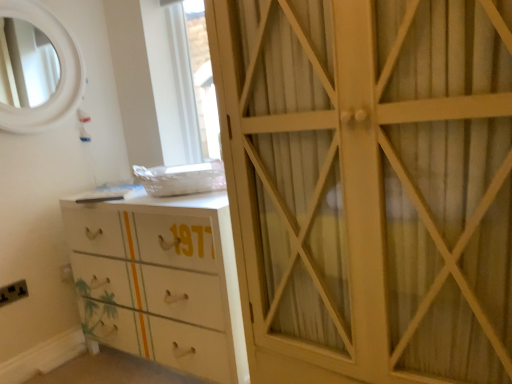
Question: Is the surface of black plastic electric outlet at lower left in direct contact with white wood cabinet at right?

Choices:
 (A) no
 (B) yes

Answer: (A)

Question: Is the position of black plastic electric outlet at lower left more distant than that of white wood cabinet at right?

Choices:
 (A) yes
 (B) no

Answer: (A)

Question: Can you confirm if black plastic electric outlet at lower left is smaller than white wood cabinet at right?

Choices:
 (A) yes
 (B) no

Answer: (A)

Question: Can you confirm if black plastic electric outlet at lower left is thinner than white wood cabinet at right?

Choices:
 (A) yes
 (B) no

Answer: (A)

Question: From a real-world perspective, is black plastic electric outlet at lower left on top of white wood cabinet at right?

Choices:
 (A) no
 (B) yes

Answer: (A)

Question: Is point click(x=181, y=314) closer or farther from the camera than point click(x=16, y=292)?

Choices:
 (A) farther
 (B) closer

Answer: (B)

Question: Is white glossy chest of drawers at lower left in front of or behind black plastic electric outlet at lower left in the image?

Choices:
 (A) front
 (B) behind

Answer: (A)

Question: Is white glossy chest of drawers at lower left wider or thinner than black plastic electric outlet at lower left?

Choices:
 (A) thin
 (B) wide

Answer: (B)

Question: From the image's perspective, relative to black plastic electric outlet at lower left, is white glossy chest of drawers at lower left above or below?

Choices:
 (A) above
 (B) below

Answer: (A)

Question: Looking at their shapes, would you say black plastic electric outlet at lower left is wider or thinner than white wood cabinet at right?

Choices:
 (A) thin
 (B) wide

Answer: (A)

Question: Considering the relative positions of black plastic electric outlet at lower left and white wood cabinet at right in the image provided, is black plastic electric outlet at lower left to the left or to the right of white wood cabinet at right?

Choices:
 (A) right
 (B) left

Answer: (B)

Question: Is black plastic electric outlet at lower left bigger or smaller than white wood cabinet at right?

Choices:
 (A) small
 (B) big

Answer: (A)

Question: From a real-world perspective, relative to white wood cabinet at right, is black plastic electric outlet at lower left vertically above or below?

Choices:
 (A) above
 (B) below

Answer: (B)

Question: Looking at their shapes, would you say white glossy chest of drawers at lower left is wider or thinner than white wood cabinet at right?

Choices:
 (A) thin
 (B) wide

Answer: (A)

Question: Would you say white glossy chest of drawers at lower left is to the left or to the right of white wood cabinet at right in the picture?

Choices:
 (A) left
 (B) right

Answer: (A)